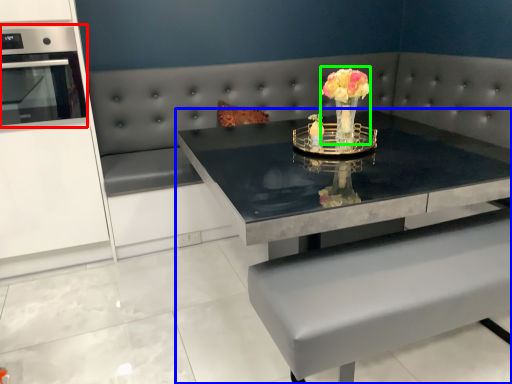
Question: Based on their relative distances, which object is farther from appliance (highlighted by a red box)? Choose from table (highlighted by a blue box) and floral arrangement (highlighted by a green box).

Choices:
 (A) table
 (B) floral arrangement

Answer: (B)